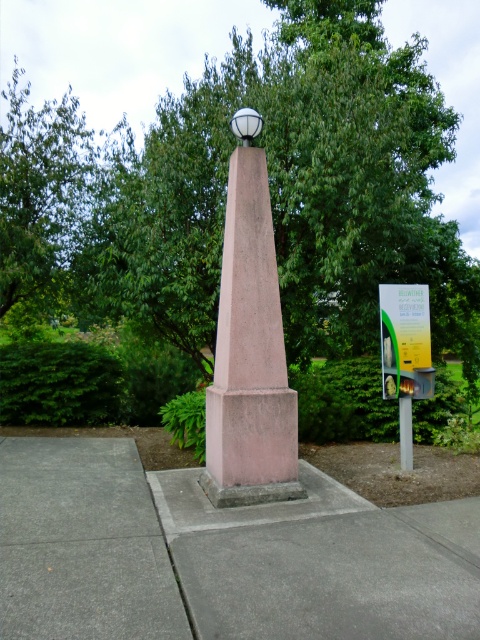
Does gray concrete pavement at center appear under pink concrete obelisk at center?

Yes, gray concrete pavement at center is below pink concrete obelisk at center.

Is gray concrete pavement at center taller than pink concrete obelisk at center?

No.

Measure the distance between point (304, 592) and camera.

They are 10.70 feet apart.

I want to click on gray concrete pavement at center, so click(x=218, y=556).

Which is more to the right, gray concrete pavement at center or metallic gray pole at center?

From the viewer's perspective, metallic gray pole at center appears more on the right side.

Is point (169, 624) positioned behind point (405, 413)?

No, (169, 624) is closer to viewer.

The width and height of the screenshot is (480, 640). I want to click on gray concrete pavement at center, so click(218, 556).

Is green leafy tree at center closer to the viewer compared to pink concrete obelisk at center?

No.

This screenshot has width=480, height=640. Describe the element at coordinates (287, 193) in the screenshot. I see `green leafy tree at center` at that location.

The image size is (480, 640). Find the location of `green leafy tree at center`. green leafy tree at center is located at coordinates (287, 193).